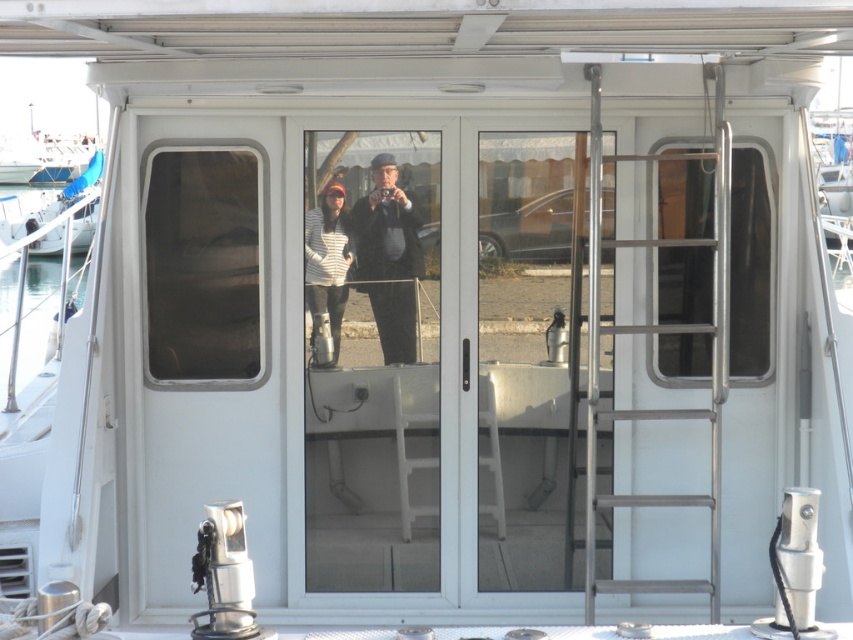
You are standing on the deck of the white glossy boat at left and want to hand a tool to the person wearing the striped sweater at center. Can you directly hand it to them without moving from your position?

The striped sweater at center is positioned under the white glossy boat at left, so you can directly hand the tool to them without needing to move from your position on the deck.

You are standing on the deck of the boat and want to reach the point at coordinates point (331, 204). If your current position is 10 feet away from the camera, can you reach that point without moving closer to the camera?

The distance of point (331, 204) from the camera is 19.11 feet. Since you are currently 10 feet away from the camera, you need to move an additional 9.11 feet towards the point to reach it. Therefore, you cannot reach the point without moving closer to the camera.

You are a photographer trying to position your matte black camera at center precisely at point 0.405 on the x axis and 0.456 on the y axis. According to the scene, is your camera already correctly positioned?

Yes, the matte black camera at center is already positioned at coordinates 0.405 on the x axis and 0.456 on the y axis as specified.